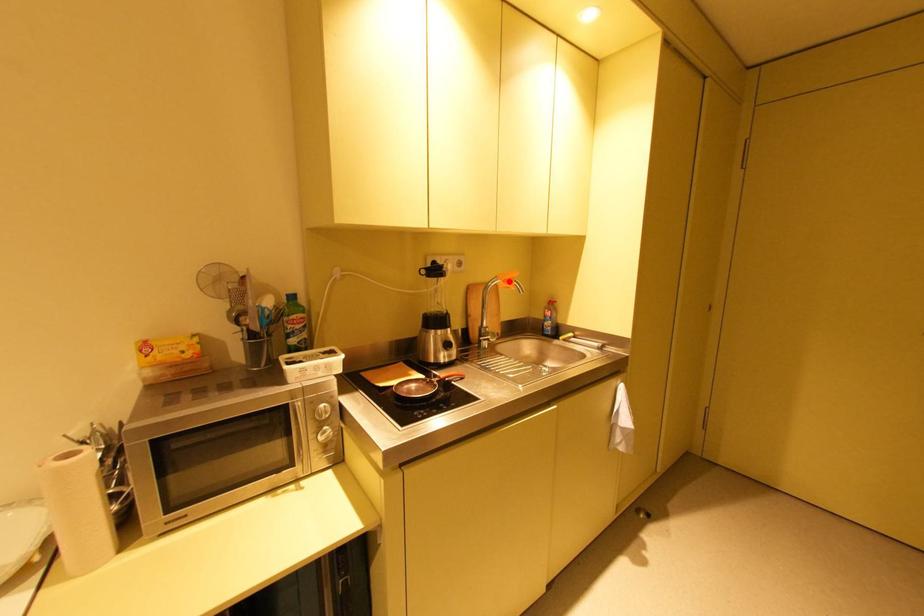
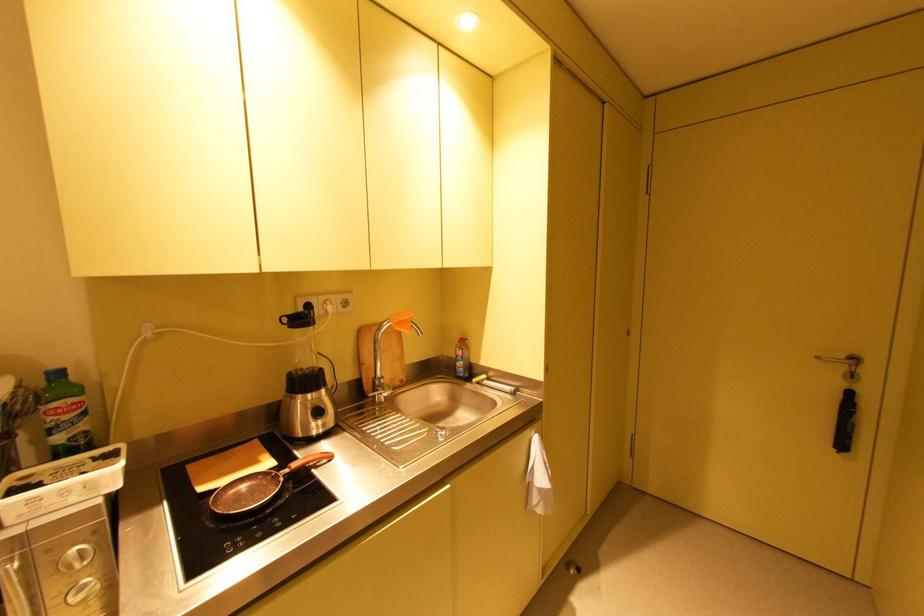
Locate, in the second image, the point that corresponds to the highlighted location in the first image.

(400, 325)